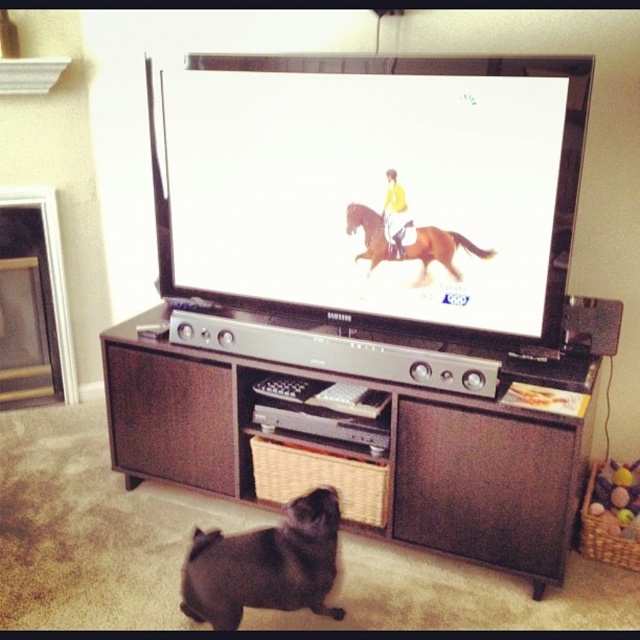
Question: Can you confirm if white glossy screen at center is positioned above brown wood entertainment center at center?

Choices:
 (A) yes
 (B) no

Answer: (A)

Question: Which object is positioned farthest from the brown glossy horse at center?

Choices:
 (A) yellow matte/jersey at center
 (B) white glossy screen at center
 (C) brown wood entertainment center at center

Answer: (C)

Question: Considering the real-world distances, which object is farthest from the brown wood entertainment center at center?

Choices:
 (A) white glossy screen at center
 (B) black matte dog at lower center
 (C) brown glossy horse at center
 (D) yellow matte/jersey at center

Answer: (D)

Question: Can you confirm if brown wood entertainment center at center is positioned to the left of black matte dog at lower center?

Choices:
 (A) yes
 (B) no

Answer: (B)

Question: In this image, where is brown wood entertainment center at center located relative to yellow matte/jersey at center?

Choices:
 (A) above
 (B) below

Answer: (B)

Question: Among these objects, which one is farthest from the camera?

Choices:
 (A) brown glossy horse at center
 (B) black matte dog at lower center
 (C) yellow matte/jersey at center

Answer: (C)